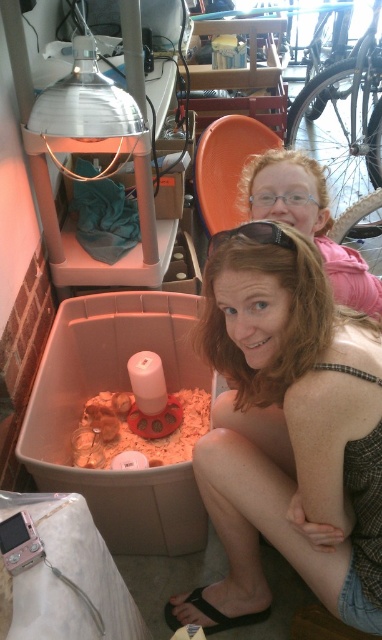
Does blonde hair at center appear under black plastic goggles at center?

Indeed, blonde hair at center is positioned under black plastic goggles at center.

Is blonde hair at center in front of black plastic goggles at center?

Yes.

Is point (226, 250) positioned in front of point (270, 230)?

No, (226, 250) is behind (270, 230).

Where is `blonde hair at center`? blonde hair at center is located at coordinates (286, 435).

Which is behind, point (370, 513) or point (341, 282)?

Point (341, 282)

Is point (325, 307) closer to camera compared to point (247, 166)?

That is True.

Between point (255, 374) and point (268, 180), which one is positioned in front?

Point (255, 374) is more forward.

Identify the location of blonde hair at center. This screenshot has width=382, height=640. (286, 435).

Does matte pink shirt at upper right lie in front of black plastic goggles at center?

No.

Measure the distance between point [370,280] and camera.

A distance of 4.66 feet exists between point [370,280] and camera.

This screenshot has height=640, width=382. Identify the location of matte pink shirt at upper right. (307, 220).